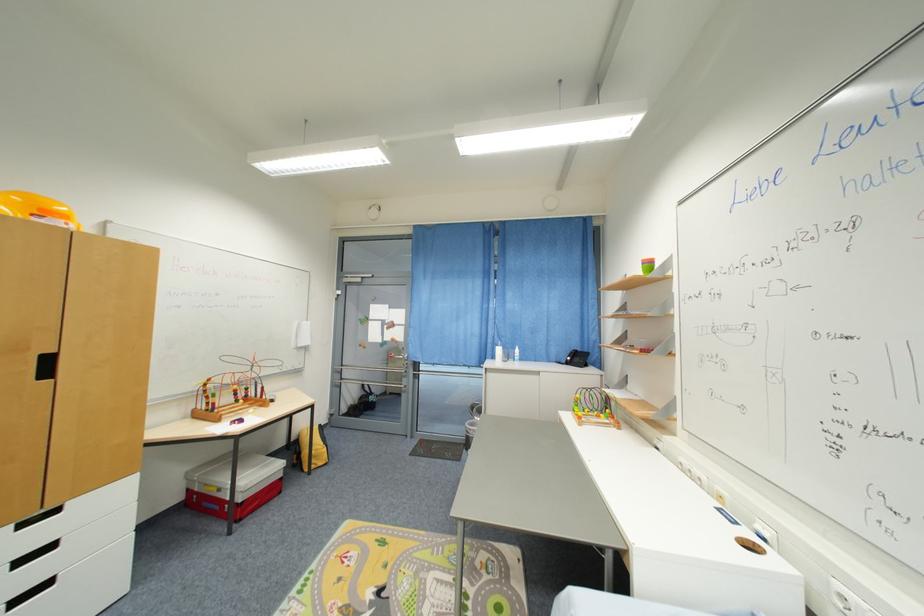
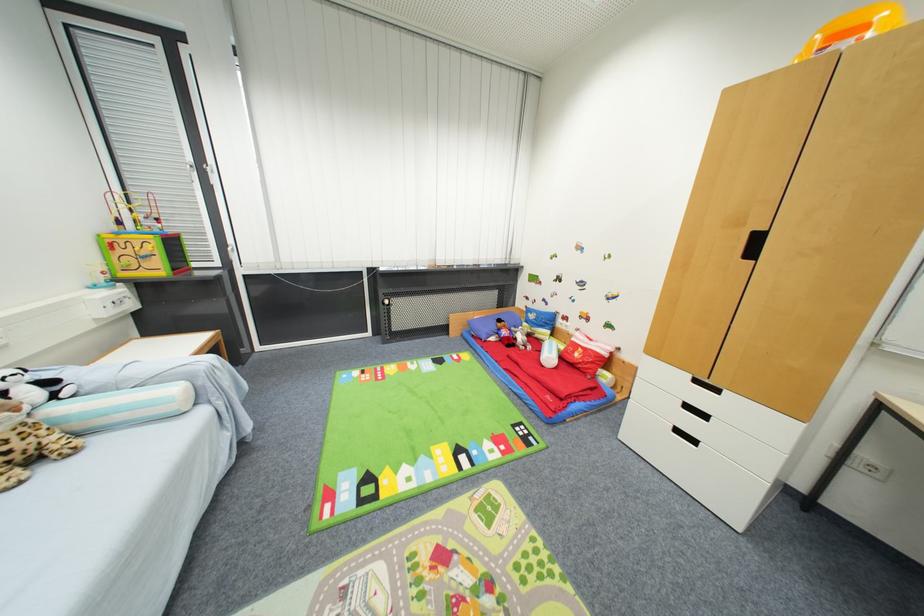
Locate, in the second image, the point that corresponds to [52,376] in the first image.

(757, 254)